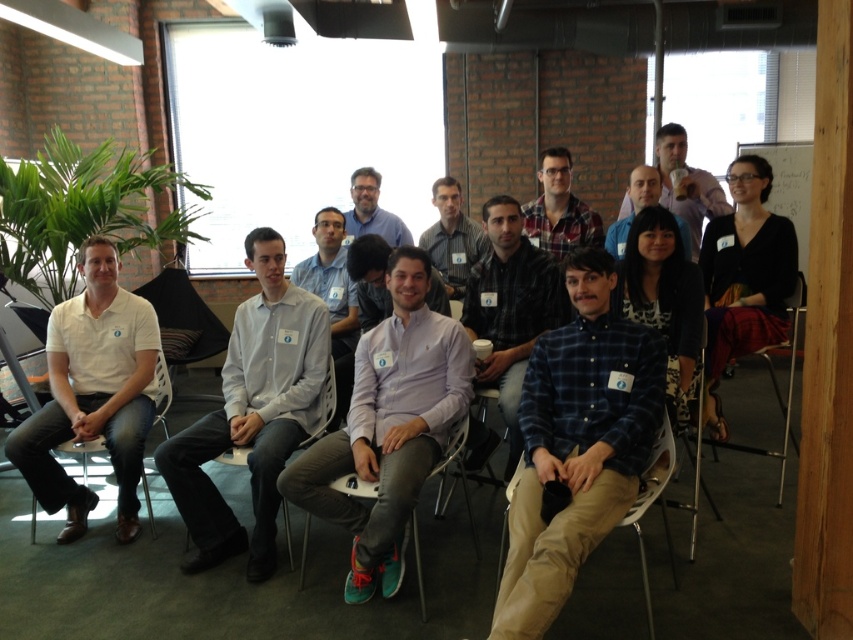
Question: Which object is the farthest from the white shirt at center?

Choices:
 (A) black matte shirt at upper right
 (B) white plastic chair at center

Answer: (A)

Question: Which point is farther to the camera?

Choices:
 (A) (567, 225)
 (B) (793, 337)
 (C) (520, 353)
 (D) (120, 374)

Answer: (A)

Question: Can you confirm if light gray shirt at center is bigger than metallic silver chair at lower right?

Choices:
 (A) no
 (B) yes

Answer: (A)

Question: Considering the relative positions of blue plaid shirt at center and white shirt at center in the image provided, where is blue plaid shirt at center located with respect to white shirt at center?

Choices:
 (A) below
 (B) above

Answer: (A)

Question: Considering the relative positions of white cotton shirt at left and matte black shirt at center in the image provided, where is white cotton shirt at left located with respect to matte black shirt at center?

Choices:
 (A) below
 (B) above

Answer: (A)

Question: Among these objects, which one is nearest to the camera?

Choices:
 (A) black matte shirt at upper right
 (B) light blue shirt at center
 (C) metallic silver chair at lower right
 (D) plaid flannel shirt at center

Answer: (B)